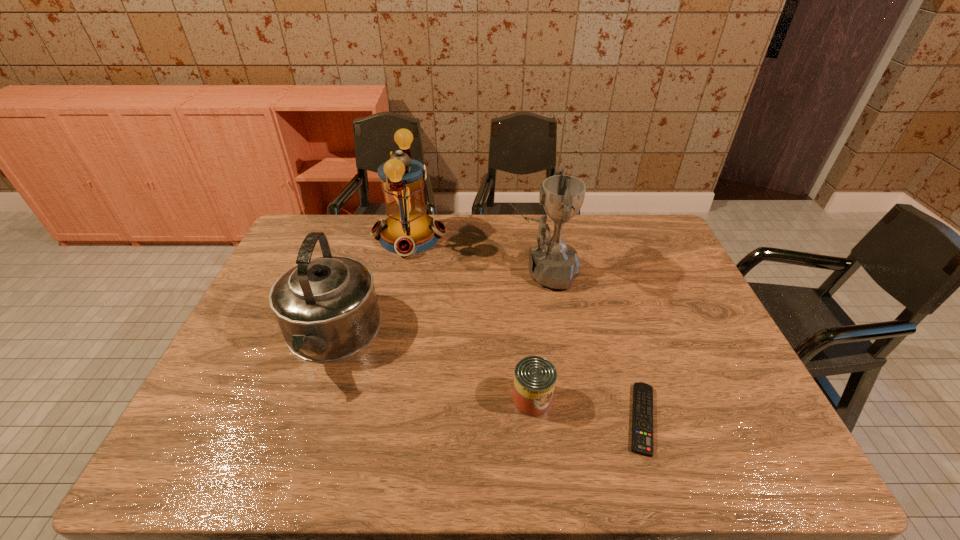
You are a GUI agent. You are given a task and a screenshot of the screen. Output one action in this format:
    pyautogui.click(x=<x>, y=<y>)
    Task: Click on the lantern
    Image resolution: width=960 pixels, height=540 pixels.
    Given the screenshot: What is the action you would take?
    pyautogui.click(x=407, y=230)

What are the coordinates of `award` in the screenshot? It's located at (553, 263).

Identify the location of kettle. Image resolution: width=960 pixels, height=540 pixels. (326, 307).

In order to click on can in this screenshot , I will do `click(534, 377)`.

Find the location of a particular element. the shortest object is located at coordinates (642, 416).

Where is `the rightmost object`? This screenshot has height=540, width=960. the rightmost object is located at coordinates (642, 416).

Find the location of `vacant region located 0.160m on the front-facing side of the lantern`. vacant region located 0.160m on the front-facing side of the lantern is located at coordinates (492, 237).

What are the coordinates of `vacant space located 0.060m on the side with emblem of the award` in the screenshot? It's located at (488, 272).

This screenshot has width=960, height=540. In order to click on vacant region located on the side with emblem of the award in this screenshot , I will do `click(392, 272)`.

Find the location of `vacant space situated on the side with emblem of the award`. vacant space situated on the side with emblem of the award is located at coordinates (463, 272).